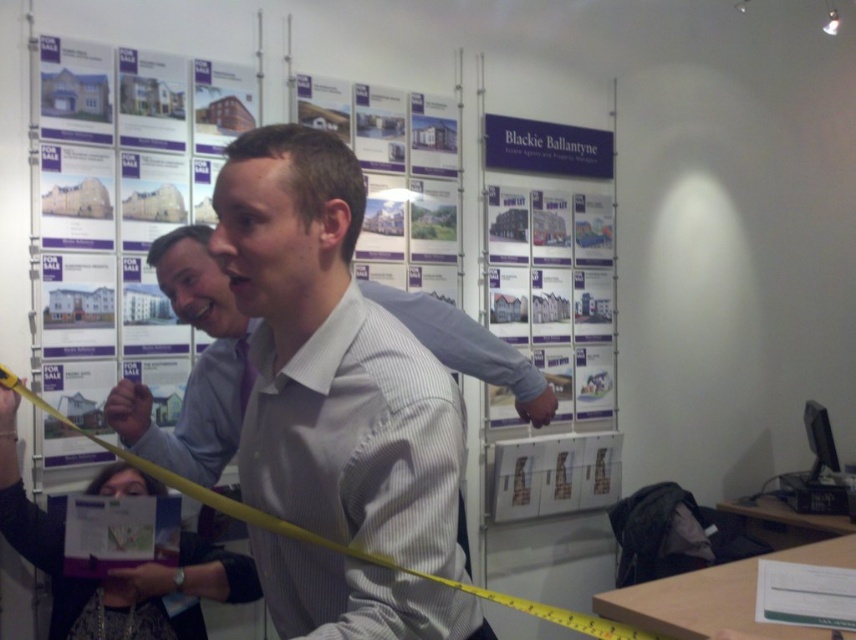
You are standing in the real estate office and see two points marked on the wall. Which point is closer to you, point (182, 570) or point (168, 273)?

Point (182, 570) is closer to you because it is further to the viewer than point (168, 273).

You are standing in the real estate office and want to find the white shirt at center. According to the coordinates provided, where should you look relative to the property advertisements on the wall?

The white shirt at center is located at coordinates point 0.891 on the x axis and 0.137 on the y axis, which is to the right and slightly below the center of the property advertisements wall.